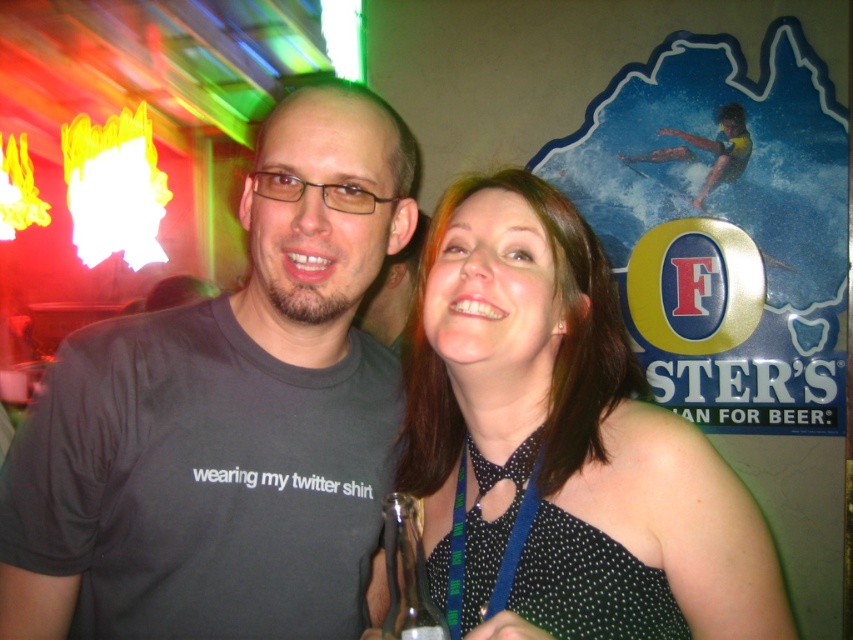
Question: Which of the following is the farthest from the observer?

Choices:
 (A) (154, 376)
 (B) (433, 605)
 (C) (547, 598)

Answer: (A)

Question: Does dark gray t-shirt at center come behind clear glass bottle at center?

Choices:
 (A) yes
 (B) no

Answer: (A)

Question: Which object is positioned closest to the clear glass bottle at center?

Choices:
 (A) black dotted dress at center
 (B) dark gray t-shirt at center

Answer: (A)

Question: Does dark gray t-shirt at center have a lesser width compared to black dotted dress at center?

Choices:
 (A) yes
 (B) no

Answer: (B)

Question: Which of these objects is positioned farthest from the clear glass bottle at center?

Choices:
 (A) black dotted dress at center
 (B) dark gray t-shirt at center

Answer: (B)

Question: Where is black dotted dress at center located in relation to clear glass bottle at center in the image?

Choices:
 (A) below
 (B) above

Answer: (B)